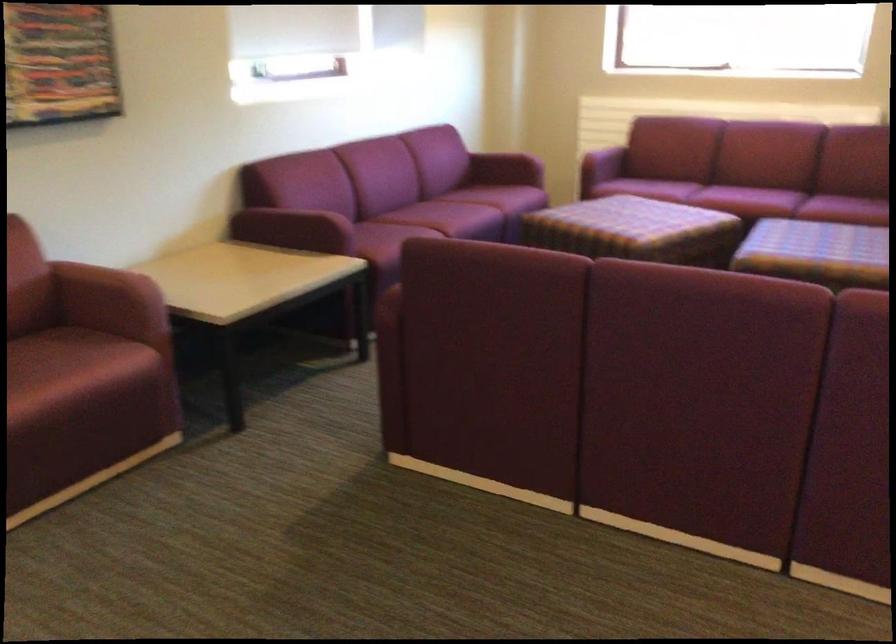
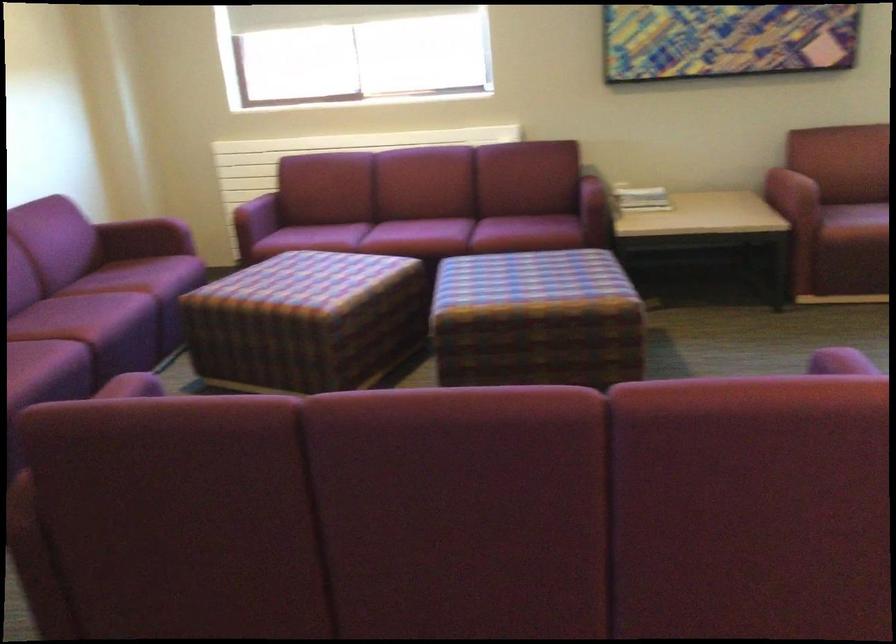
Question: The camera is either moving clockwise (left) or counter-clockwise (right) around the object. The first image is from the beginning of the video and the second image is from the end. Is the camera moving left or right when shooting the video?

Choices:
 (A) Left
 (B) Right

Answer: (A)